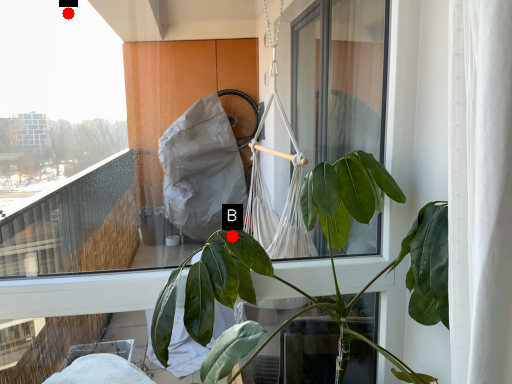
Question: Two points are circled on the image, labeled by A and B beside each circle. Which point is further to the camera?

Choices:
 (A) A is further
 (B) B is further

Answer: (A)